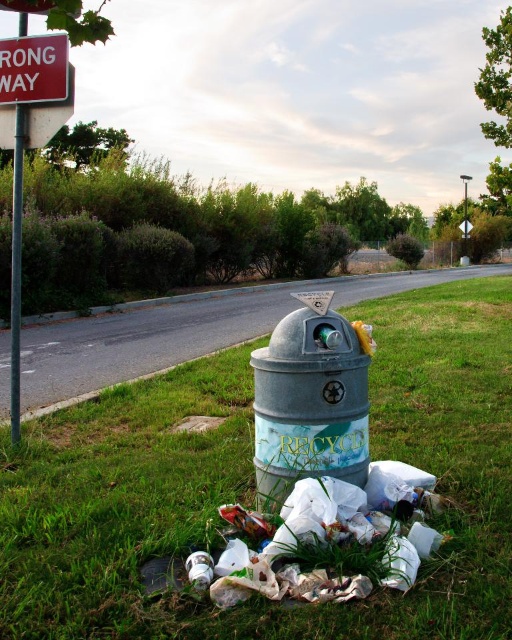
You are a park ranger who notices the white plastic bags at lower center and the metallic pole at left. Which object is closer to the ground?

The white plastic bags at lower center are closer to the ground since they are positioned below the metallic pole at left.

You are a park maintenance worker who needs to collect litter. You see the white plastic bags at lower center and the red plastic sign at upper left. Which object is closer to the recycling bin?

The white plastic bags at lower center are closer to the recycling bin because they are positioned under the red plastic sign at upper left, which is farther away.

You are a park visitor who wants to locate the nearest trash can. You see the red plastic sign at upper left and the metallic pole at left. Which object is closer to you?

The red plastic sign at upper left is closer to you because it is in front of the metallic pole at left.